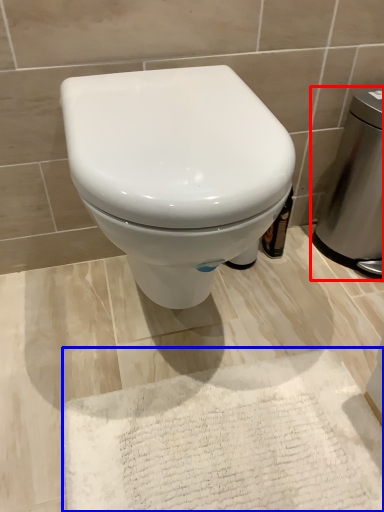
Question: Which object appears closest to the camera in this image, appliance (highlighted by a red box) or bath mat (highlighted by a blue box)?

Choices:
 (A) appliance
 (B) bath mat

Answer: (B)